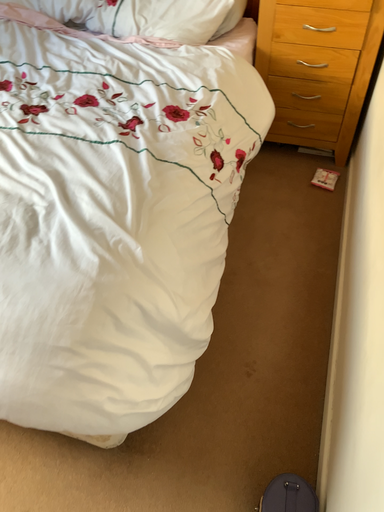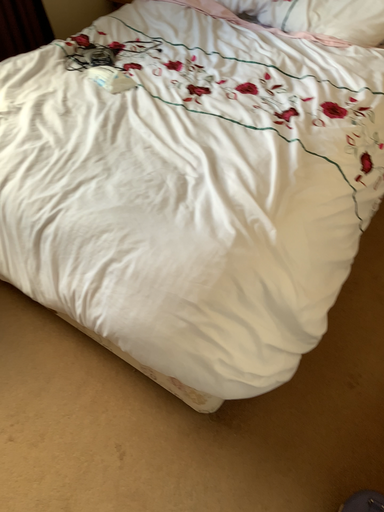
Question: How did the camera likely rotate when shooting the video?

Choices:
 (A) rotated left
 (B) rotated right

Answer: (A)